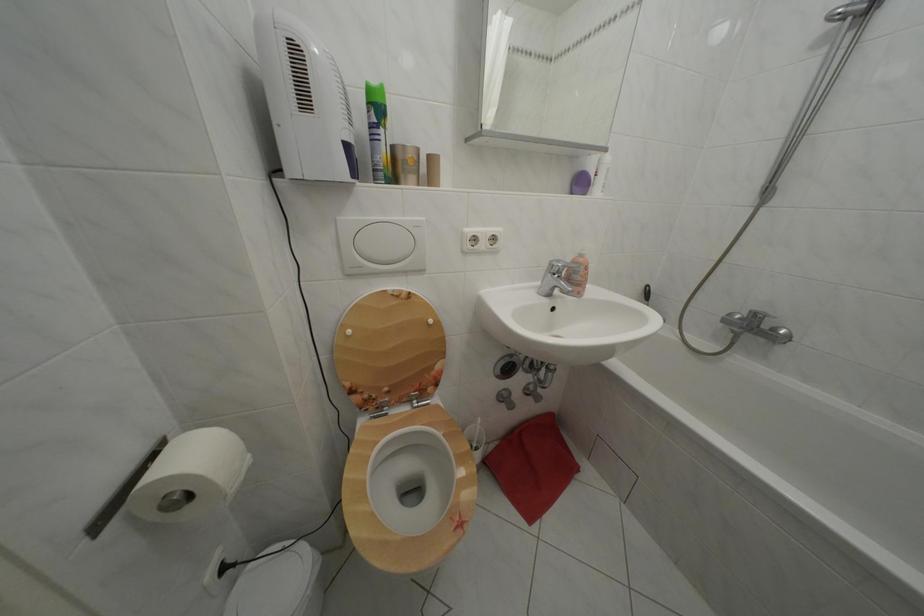
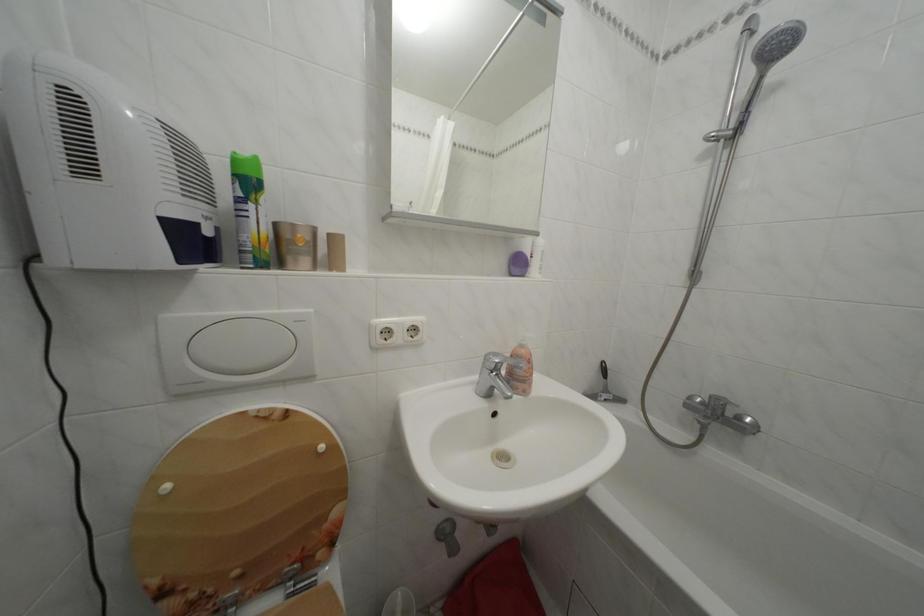
Locate, in the second image, the point that corresponds to pixel 590 190 in the first image.

(527, 270)